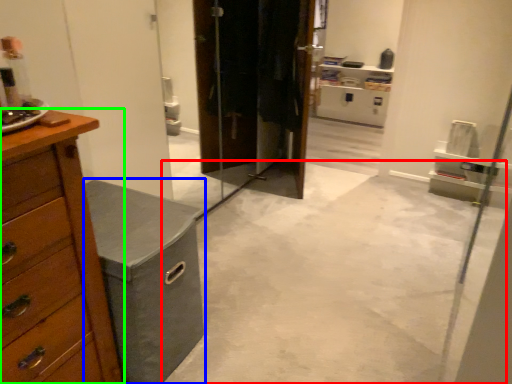
Question: Which object is positioned farthest from concrete (highlighted by a red box)? Select from vanity (highlighted by a blue box) and chest of drawers (highlighted by a green box).

Choices:
 (A) vanity
 (B) chest of drawers

Answer: (B)